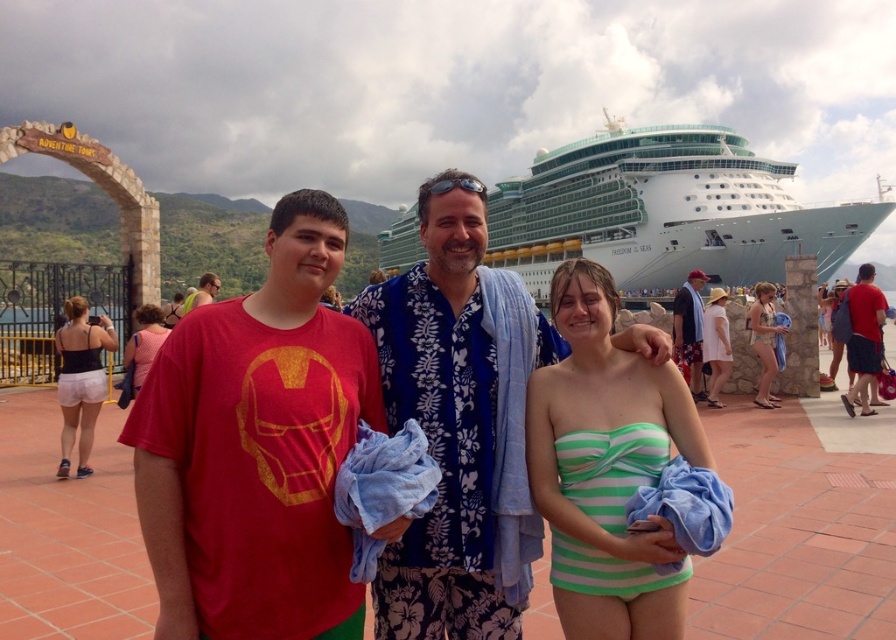
Question: Can you confirm if white glossy cruise ship at upper center is thinner than green striped swimsuit at center?

Choices:
 (A) yes
 (B) no

Answer: (B)

Question: Which of the following is the closest to the observer?

Choices:
 (A) matte red t-shirt at right
 (B) green striped bikini at center

Answer: (A)

Question: Is blue floral shirt at center to the right of matte pink dress at center from the viewer's perspective?

Choices:
 (A) no
 (B) yes

Answer: (B)

Question: Which of the following is the farthest from the observer?

Choices:
 (A) blue floral shirt at right
 (B) matte black tank top at left
 (C) matte pink dress at center

Answer: (A)

Question: Based on their relative distances, which object is nearer to the matte red t-shirt at center?

Choices:
 (A) green striped swimsuit at center
 (B) matte pink dress at center
 (C) matte red t-shirt at right

Answer: (A)

Question: Does blue floral shirt at right lie behind white cotton dress at right?

Choices:
 (A) no
 (B) yes

Answer: (B)